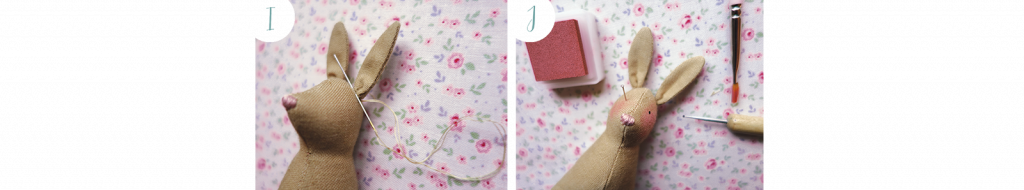
Locate an element on the screen. stuffed rabbit is located at coordinates (311, 175).